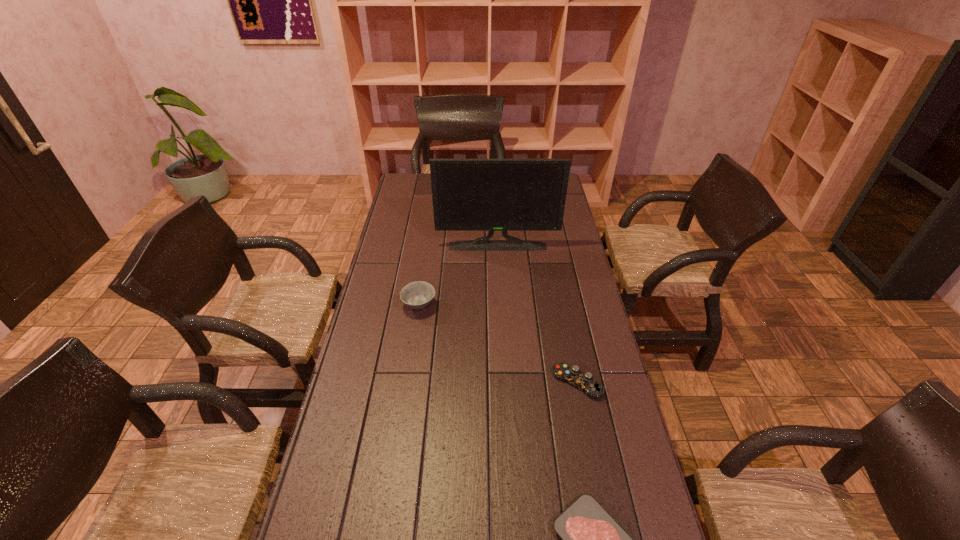
Where is `object that is the second closest to the shortest object`? object that is the second closest to the shortest object is located at coordinates (417, 295).

Identify the location of object identified as the closest to the farthest object. This screenshot has width=960, height=540. (417, 295).

Locate an element on the screen. The image size is (960, 540). vacant space that satisfies the following two spatial constraints: 1. on the front side of the third shortest object; 2. on the right side of the second shortest object is located at coordinates 408,383.

Where is `vacant region that satisfies the following two spatial constraints: 1. on the front side of the third tallest object; 2. on the right side of the second farthest object`? The image size is (960, 540). vacant region that satisfies the following two spatial constraints: 1. on the front side of the third tallest object; 2. on the right side of the second farthest object is located at coordinates (408, 383).

Image resolution: width=960 pixels, height=540 pixels. Find the location of `blank space that satisfies the following two spatial constraints: 1. on the front-facing side of the monitor; 2. on the left side of the control`. blank space that satisfies the following two spatial constraints: 1. on the front-facing side of the monitor; 2. on the left side of the control is located at coordinates (504, 383).